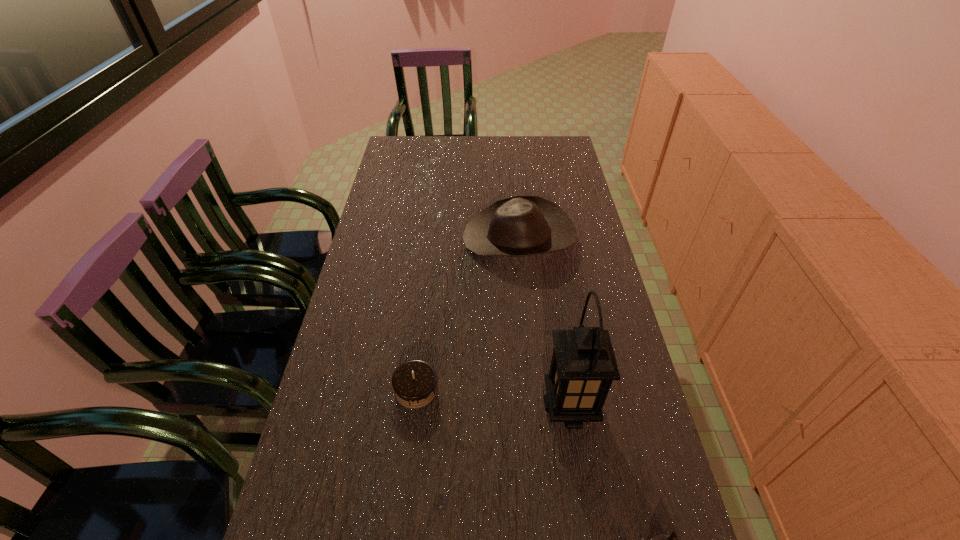
In the image, there is a desktop. Where is `vacant space at the far edge`? This screenshot has height=540, width=960. vacant space at the far edge is located at coordinates (507, 159).

The image size is (960, 540). In the image, there is a desktop. Find the location of `vacant space at the left edge`. vacant space at the left edge is located at coordinates (395, 178).

In the image, there is a desktop. Where is `vacant area at the right edge`? vacant area at the right edge is located at coordinates (552, 259).

Where is `vacant space at the far left corner of the desktop`? The width and height of the screenshot is (960, 540). vacant space at the far left corner of the desktop is located at coordinates (392, 139).

This screenshot has width=960, height=540. Find the location of `free point between the farthest object and the tallest object`. free point between the farthest object and the tallest object is located at coordinates pyautogui.click(x=544, y=322).

What are the coordinates of `blank region between the lantern and the farther chocolate cake` in the screenshot? It's located at (493, 398).

Where is `vacant area between the third shortest object and the lantern`? vacant area between the third shortest object and the lantern is located at coordinates (544, 322).

At what (x,y) coordinates should I click in order to perform the action: click on vacant space that's between the farther chocolate cake and the tallest object. Please return your answer as a coordinate pair (x, y). Looking at the image, I should click on (493, 398).

Identify which object is located as the nearest to the lantern. Please provide its 2D coordinates. Your answer should be formatted as a tuple, i.e. [(x, y)], where the tuple contains the x and y coordinates of a point satisfying the conditions above.

[(662, 539)]

At what (x,y) coordinates should I click in order to perform the action: click on object that stands as the closest to the tallest object. Please return your answer as a coordinate pair (x, y). Looking at the image, I should click on (662, 539).